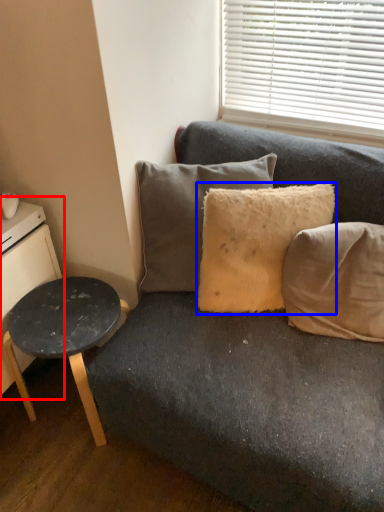
Question: Which of the following is the farthest to the observer, dresser (highlighted by a red box) or pillow (highlighted by a blue box)?

Choices:
 (A) dresser
 (B) pillow

Answer: (B)